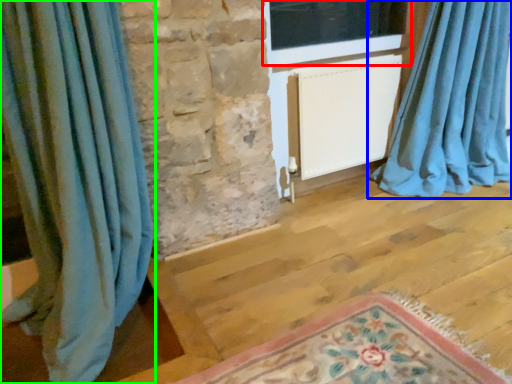
Question: Based on their relative distances, which object is farther from window (highlighted by a red box)? Choose from curtain (highlighted by a blue box) and curtain (highlighted by a green box).

Choices:
 (A) curtain
 (B) curtain

Answer: (B)